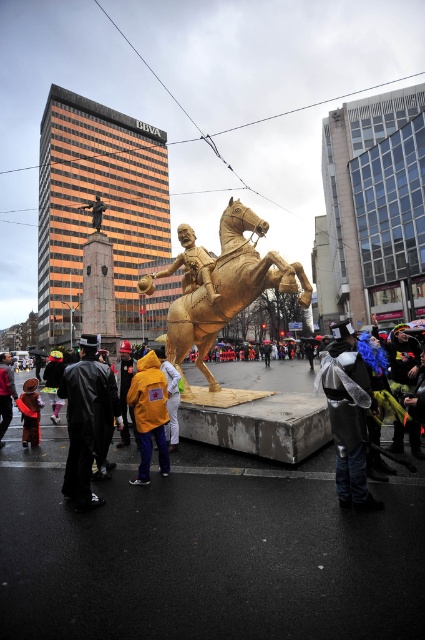
You are a photographer standing at the edge of the square, wanting to take a picture of the gold metallic horse at center without any people in the frame. Is the black leather coat at lower left blocking your view of the horse?

The black leather coat at lower left is behind the gold metallic horse at center, so it won not block your view of the horse.

You are a photographer standing in front of the large golden statue. You want to take a photo that includes both the velvet red coat at lower left and the yellow fabric coat at center. Which coat should you adjust your camera angle to include first if you want to capture both in the frame?

The velvet red coat at lower left is to the left of the yellow fabric coat at center, so you should adjust your camera angle to include the velvet red coat at lower left first to ensure both are in the frame.

You are a photographer at the event and want to capture both the yellow matte jacket at center and the velvet red coat at lower left in the same frame. Based on their positions, which one should you focus on first to ensure both are in the shot?

You should focus on the velvet red coat at lower left first because the yellow matte jacket at center is to the right of it, so by centering the velvet red coat at lower left, the yellow matte jacket at center will naturally fall into the frame to its right.